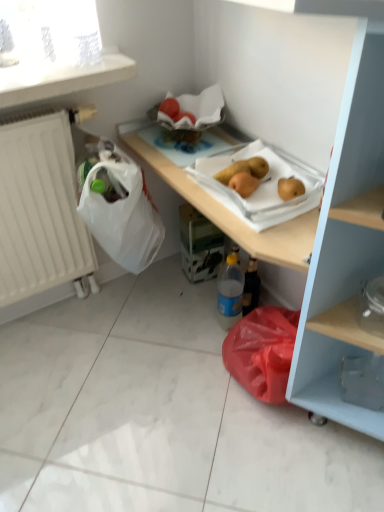
Question: Do you think white matte radiator at left is within blue plastic bottle at lower center, or outside of it?

Choices:
 (A) inside
 (B) outside

Answer: (B)

Question: Considering the positions of point (62, 178) and point (220, 279), is point (62, 178) closer or farther from the camera than point (220, 279)?

Choices:
 (A) closer
 (B) farther

Answer: (A)

Question: Considering the real-world distances, which object is closest to the blue plastic bottle at lower center?

Choices:
 (A) yellow matte pear at center
 (B) white matte radiator at left
 (C) transparent plastic carton at center

Answer: (C)

Question: Estimate the real-world distances between objects in this image. Which object is farther from the yellow matte pear at center?

Choices:
 (A) white matte radiator at left
 (B) blue plastic bottle at lower center
 (C) transparent plastic carton at center

Answer: (A)